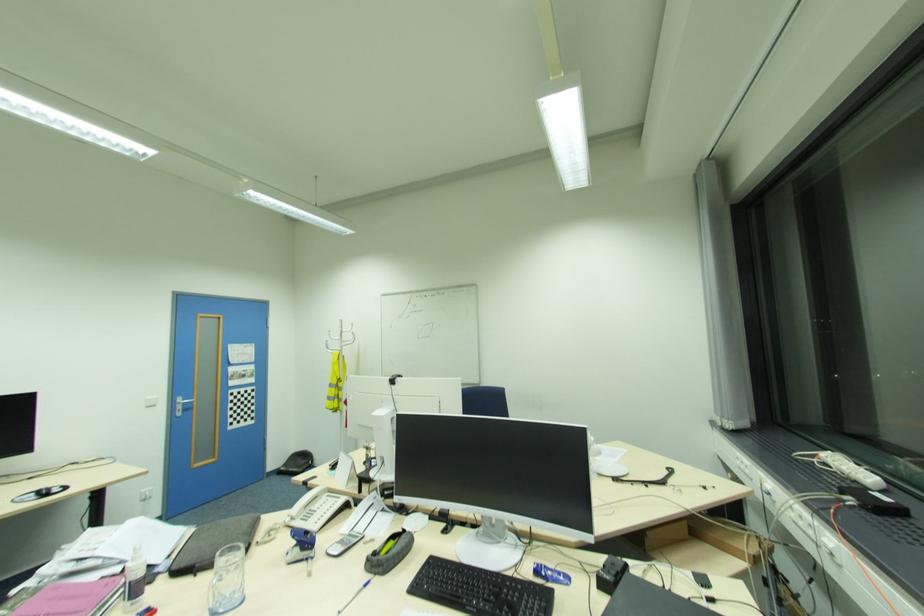
Find the location of `black and silver pen`. black and silver pen is located at coordinates (354, 596).